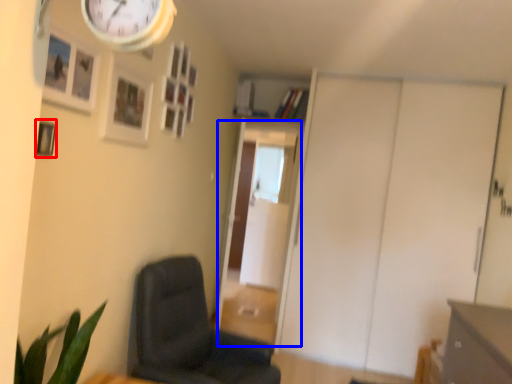
Question: Which object appears closest to the camera in this image, picture frame (highlighted by a red box) or glass door (highlighted by a blue box)?

Choices:
 (A) picture frame
 (B) glass door

Answer: (A)